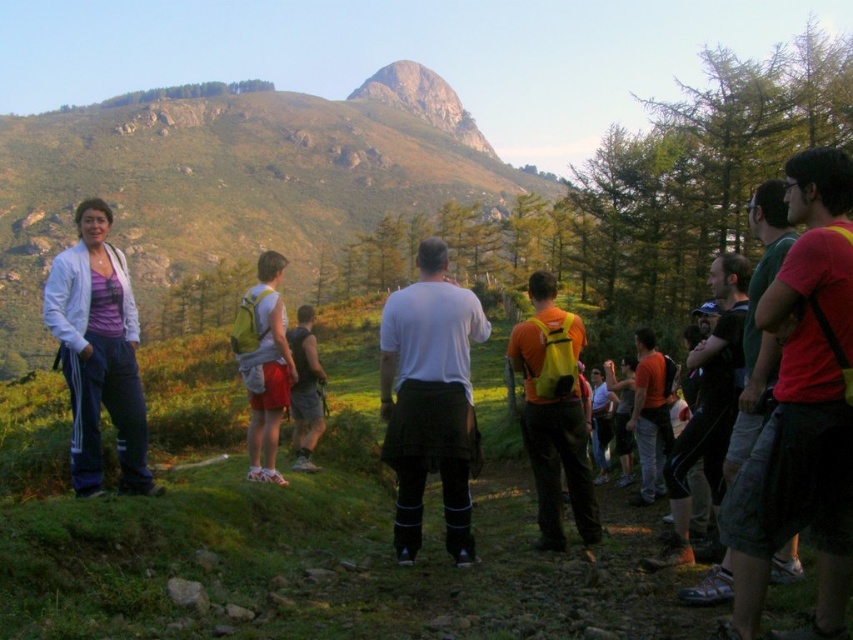
Question: Can you confirm if matte red shirt at right is smaller than orange fabric backpack at center-right?

Choices:
 (A) yes
 (B) no

Answer: (B)

Question: Does yellow fabric backpack at center appear on the left side of matte yellow backpack at center?

Choices:
 (A) yes
 (B) no

Answer: (B)

Question: Which object is farther from the camera taking this photo?

Choices:
 (A) matte yellow backpack at center
 (B) matte red shirt at right
 (C) orange fabric backpack at center-right

Answer: (C)

Question: Based on their relative distances, which object is farther from the matte red shirt at right?

Choices:
 (A) green grassy hillside at upper left
 (B) orange fabric backpack at center-right
 (C) matte yellow backpack at center

Answer: (A)

Question: Among these points, which one is nearest to the camera?

Choices:
 (A) (561, 429)
 (B) (389, 316)

Answer: (B)

Question: Does green grassy hillside at upper left appear under yellow fabric backpack at center?

Choices:
 (A) yes
 (B) no

Answer: (B)